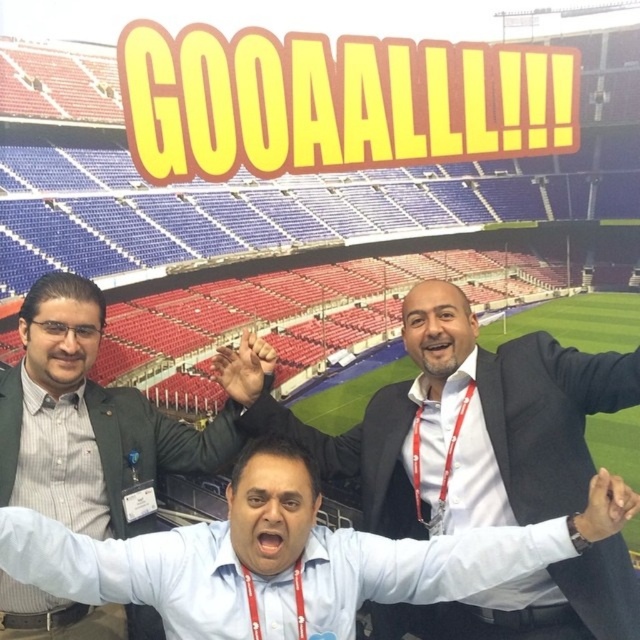
Is blue shirt at center to the right of matte black jacket at upper left from the viewer's perspective?

Yes, blue shirt at center is to the right of matte black jacket at upper left.

Is blue shirt at center below matte black jacket at upper left?

Yes, blue shirt at center is below matte black jacket at upper left.

What do you see at coordinates (289, 557) in the screenshot? I see `blue shirt at center` at bounding box center [289, 557].

Image resolution: width=640 pixels, height=640 pixels. In order to click on blue shirt at center in this screenshot , I will do pyautogui.click(x=289, y=557).

Is point (612, 618) farther from viewer compared to point (49, 410)?

That is False.

Is white glossy shirt at center further to the viewer compared to matte black jacket at upper left?

No, white glossy shirt at center is in front of matte black jacket at upper left.

Identify the location of white glossy shirt at center. The height and width of the screenshot is (640, 640). (460, 422).

Find the location of a particular element. white glossy shirt at center is located at coordinates (460, 422).

Does white glossy shirt at center have a greater width compared to blue shirt at center?

In fact, white glossy shirt at center might be narrower than blue shirt at center.

Is white glossy shirt at center in front of blue shirt at center?

No, white glossy shirt at center is behind blue shirt at center.

Measure the distance between white glossy shirt at center and camera.

white glossy shirt at center is 98.71 feet from camera.

Find the location of `white glossy shirt at center`. white glossy shirt at center is located at coordinates (460, 422).